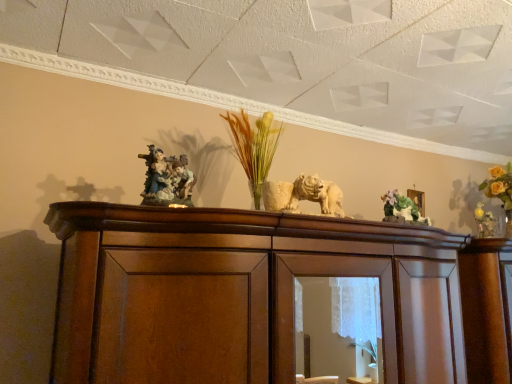
What are the coordinates of `green matte floral arrangement at upper right` in the screenshot? It's located at (402, 208).

Describe the element at coordinates (402, 208) in the screenshot. I see `green matte floral arrangement at upper right` at that location.

The width and height of the screenshot is (512, 384). What do you see at coordinates (167, 179) in the screenshot? I see `matte porcelain figurine at center` at bounding box center [167, 179].

Measure the distance between point (188,191) and camera.

Point (188,191) and camera are 5.98 feet apart.

What are the coordinates of `matte porcelain figurine at center` in the screenshot? It's located at (167, 179).

At what (x,y) coordinates should I click in order to perform the action: click on green matte floral arrangement at upper right. Please return your answer as a coordinate pair (x, y). The height and width of the screenshot is (384, 512). Looking at the image, I should click on (402, 208).

Which is more to the left, matte porcelain figurine at center or green matte floral arrangement at upper right?

matte porcelain figurine at center.

Does matte porcelain figurine at center come behind green matte floral arrangement at upper right?

No, matte porcelain figurine at center is closer to the camera.

Is point (157, 189) less distant than point (394, 202)?

Yes, point (157, 189) is in front of point (394, 202).

From the image's perspective, is matte porcelain figurine at center located beneath green matte floral arrangement at upper right?

Actually, matte porcelain figurine at center appears above green matte floral arrangement at upper right in the image.

From a real-world perspective, is matte porcelain figurine at center over green matte floral arrangement at upper right?

Yes, from a real-world perspective, matte porcelain figurine at center is above green matte floral arrangement at upper right.

Is matte porcelain figurine at center wider than green matte floral arrangement at upper right?

Yes.

Considering the sizes of matte porcelain figurine at center and green matte floral arrangement at upper right in the image, is matte porcelain figurine at center taller or shorter than green matte floral arrangement at upper right?

Considering their sizes, matte porcelain figurine at center has more height than green matte floral arrangement at upper right.

Which of these two, matte porcelain figurine at center or green matte floral arrangement at upper right, is bigger?

With larger size is matte porcelain figurine at center.

Is green matte floral arrangement at upper right a part of matte porcelain figurine at center?

No.

Are matte porcelain figurine at center and green matte floral arrangement at upper right located far from each other?

No.

Is matte porcelain figurine at center turned away from green matte floral arrangement at upper right?

That's not correct — matte porcelain figurine at center is not looking away from green matte floral arrangement at upper right.

Where is `floral arrangement behind the matte porcelain figurine at center`? floral arrangement behind the matte porcelain figurine at center is located at coordinates (402, 208).

Considering the relative positions of green matte floral arrangement at upper right and matte porcelain figurine at center in the image provided, is green matte floral arrangement at upper right to the right of matte porcelain figurine at center from the viewer's perspective?

Yes, green matte floral arrangement at upper right is to the right of matte porcelain figurine at center.

In the image, is green matte floral arrangement at upper right positioned in front of or behind matte porcelain figurine at center?

Visually, green matte floral arrangement at upper right is located behind matte porcelain figurine at center.

Does point (387, 211) come closer to viewer compared to point (170, 189)?

No, (387, 211) is further to viewer.

From the image's perspective, is green matte floral arrangement at upper right on top of matte porcelain figurine at center?

No, from the image's perspective, green matte floral arrangement at upper right is not over matte porcelain figurine at center.

From a real-world perspective, is green matte floral arrangement at upper right physically above matte porcelain figurine at center?

Actually, green matte floral arrangement at upper right is physically below matte porcelain figurine at center in the real world.

Looking at this image, which of these two, green matte floral arrangement at upper right or matte porcelain figurine at center, is wider?

matte porcelain figurine at center is wider.

Between green matte floral arrangement at upper right and matte porcelain figurine at center, which one has more height?

With more height is matte porcelain figurine at center.

Is green matte floral arrangement at upper right smaller than matte porcelain figurine at center?

Correct, green matte floral arrangement at upper right occupies less space than matte porcelain figurine at center.

Is green matte floral arrangement at upper right surrounding matte porcelain figurine at center?

Definitely not — matte porcelain figurine at center is not inside green matte floral arrangement at upper right.

Would you say green matte floral arrangement at upper right is a long distance from matte porcelain figurine at center?

That's not correct — green matte floral arrangement at upper right is a little close to matte porcelain figurine at center.

Is green matte floral arrangement at upper right facing away from matte porcelain figurine at center?

That's not correct — green matte floral arrangement at upper right is not looking away from matte porcelain figurine at center.

What's the angular difference between green matte floral arrangement at upper right and matte porcelain figurine at center's facing directions?

The facing directions of green matte floral arrangement at upper right and matte porcelain figurine at center are 0.000128 degrees apart.

How far apart are green matte floral arrangement at upper right and matte porcelain figurine at center?

green matte floral arrangement at upper right and matte porcelain figurine at center are 81.71 centimeters apart from each other.

The width and height of the screenshot is (512, 384). Identify the location of animal above the green matte floral arrangement at upper right (from the image's perspective). [167, 179].

Image resolution: width=512 pixels, height=384 pixels. Identify the location of animal located in front of the green matte floral arrangement at upper right. (167, 179).

What are the coordinates of `animal lying on the left of green matte floral arrangement at upper right` in the screenshot? It's located at (167, 179).